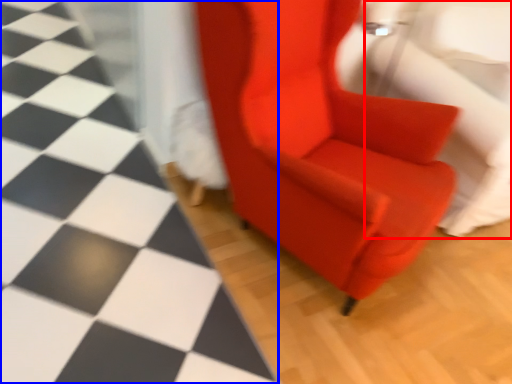
Question: Which point is further to the camera, swivel chair (highlighted by a red box) or tile (highlighted by a blue box)?

Choices:
 (A) swivel chair
 (B) tile

Answer: (A)